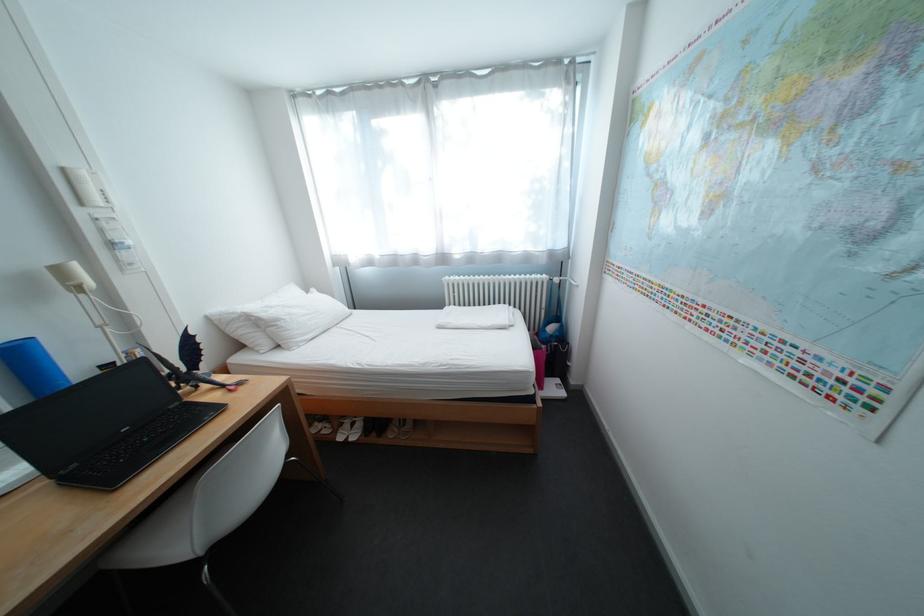
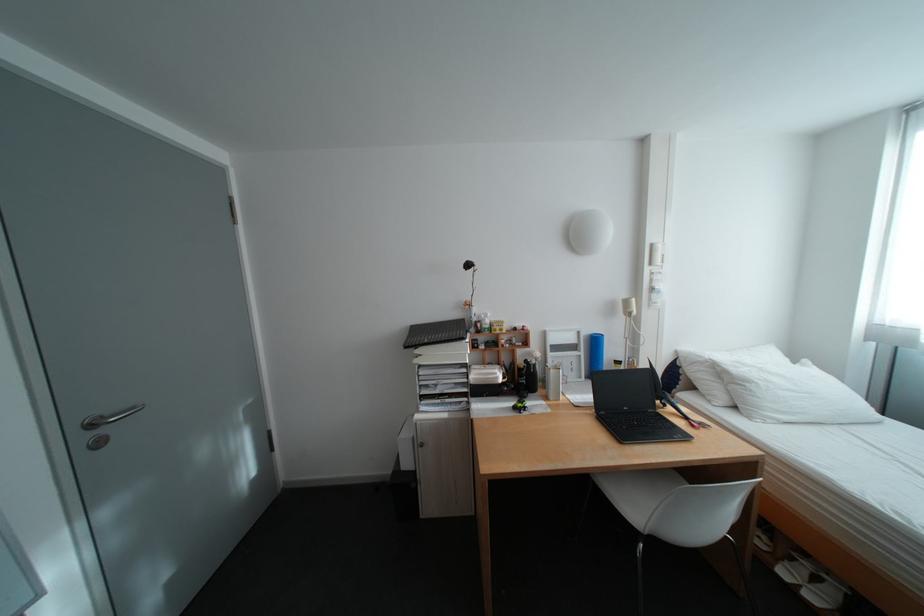
Locate, in the second image, the point that corresponds to [292,322] in the first image.

(761, 384)